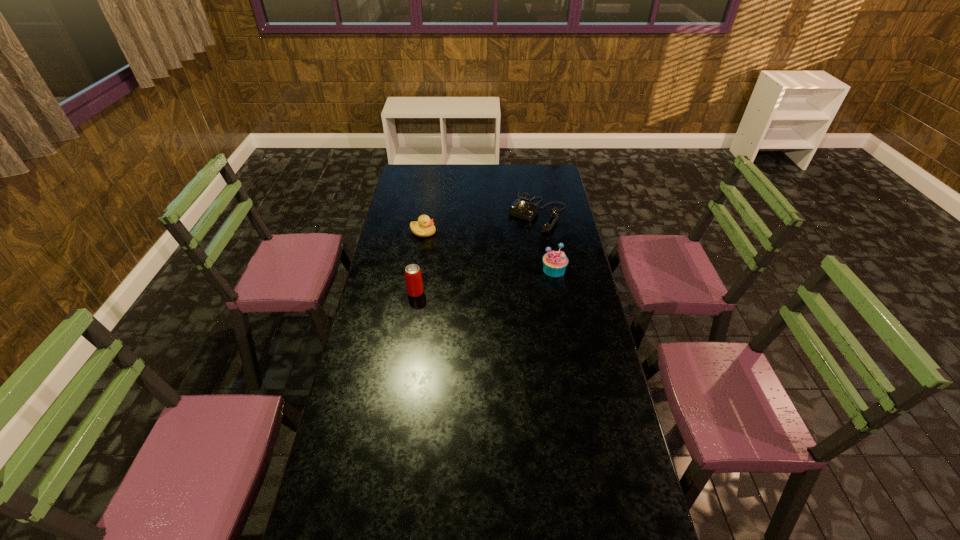
I want to click on vacant space on the desktop that is between the beer can and the muffin and is positioned on the beak of the duckling, so click(494, 280).

The image size is (960, 540). In order to click on free space on the desktop that is between the beer can and the third farthest object and is positioned on the dial of the telephone in this screenshot , I will do `click(485, 281)`.